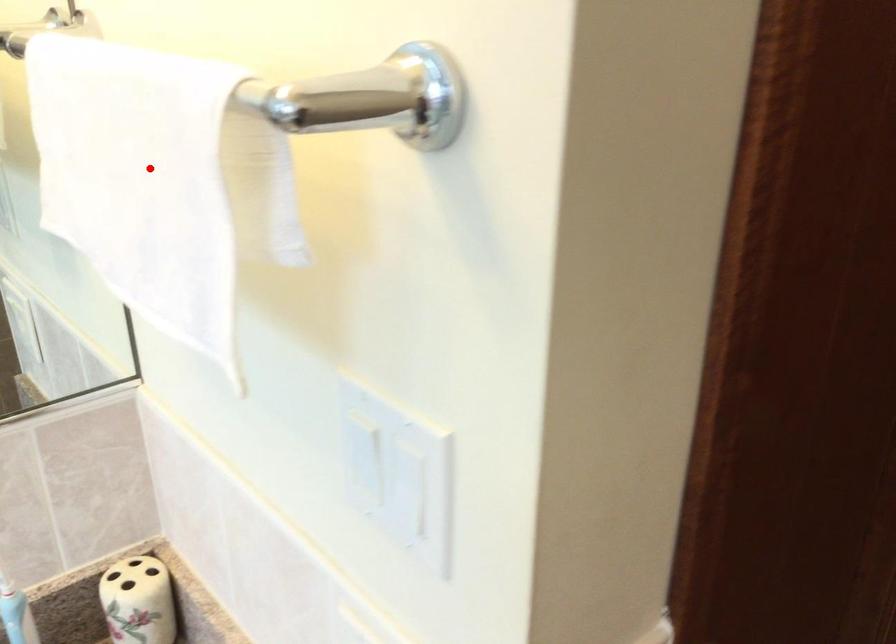
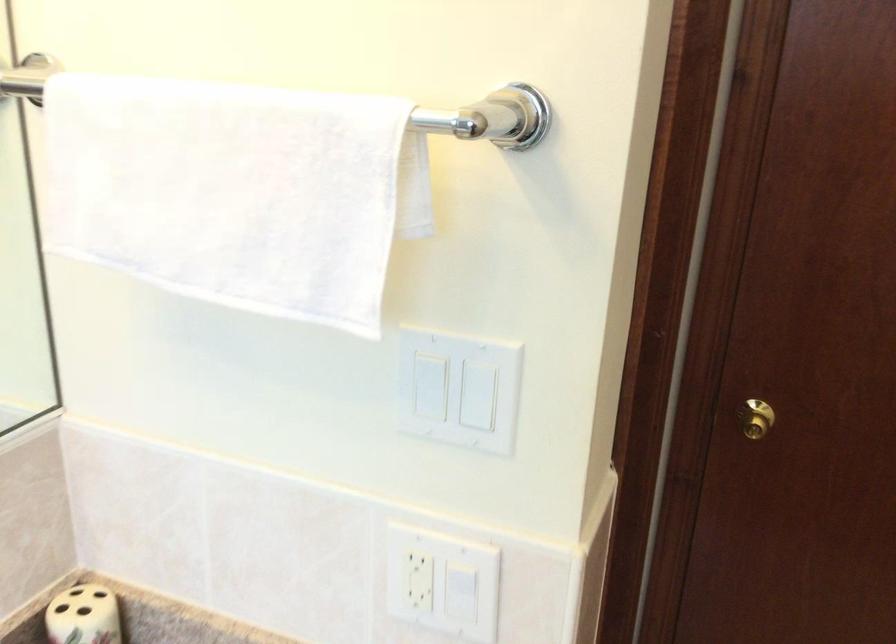
Question: I am providing you with two images of the same scene from different viewpoints. A red point is marked on the first image. Is the red point's position out of view in image 2?

Choices:
 (A) Yes
 (B) No

Answer: (B)